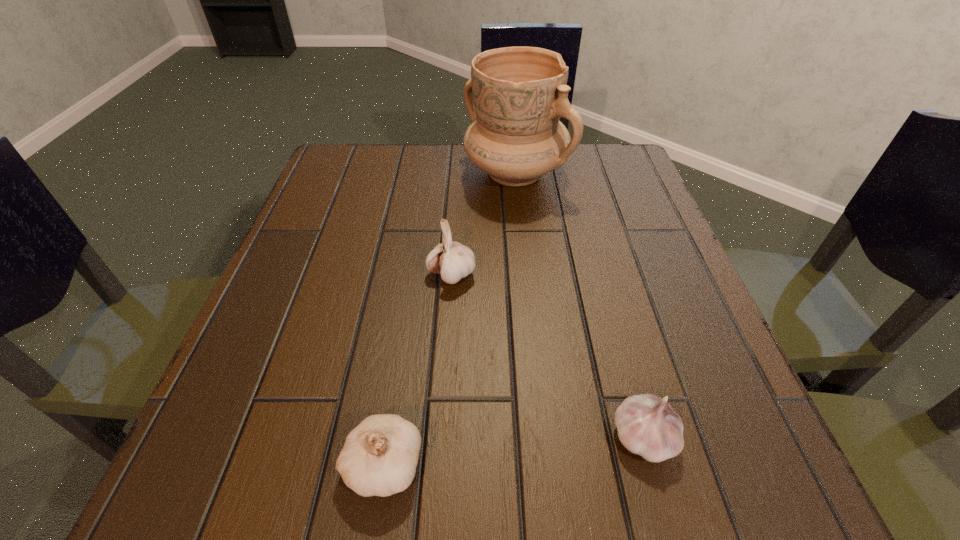
In order to click on free location at the far edge of the desktop in this screenshot , I will do `click(412, 147)`.

The height and width of the screenshot is (540, 960). Find the location of `vacant space at the near edge of the desktop`. vacant space at the near edge of the desktop is located at coordinates (617, 497).

Find the location of a particular element. The width and height of the screenshot is (960, 540). vacant area at the left edge of the desktop is located at coordinates (375, 214).

In the image, there is a desktop. At what (x,y) coordinates should I click in order to perform the action: click on free space at the right edge. Please return your answer as a coordinate pair (x, y). Looking at the image, I should click on (641, 225).

What are the coordinates of `vacant position at the far left corner of the desktop` in the screenshot? It's located at (390, 177).

In the image, there is a desktop. Where is `vacant space at the far right corner`? This screenshot has height=540, width=960. vacant space at the far right corner is located at coordinates (581, 148).

Where is `vacant area that lies between the farthest garlic and the farthest object`? The width and height of the screenshot is (960, 540). vacant area that lies between the farthest garlic and the farthest object is located at coordinates (484, 224).

At what (x,y) coordinates should I click in order to perform the action: click on vacant point located between the farthest object and the rightmost garlic. Please return your answer as a coordinate pair (x, y). Image resolution: width=960 pixels, height=540 pixels. Looking at the image, I should click on (580, 305).

Find the location of a particular element. This screenshot has width=960, height=540. free space that is in between the farthest object and the third nearest object is located at coordinates (484, 224).

What are the coordinates of `blank region between the farthest garlic and the rightmost garlic` in the screenshot? It's located at (547, 356).